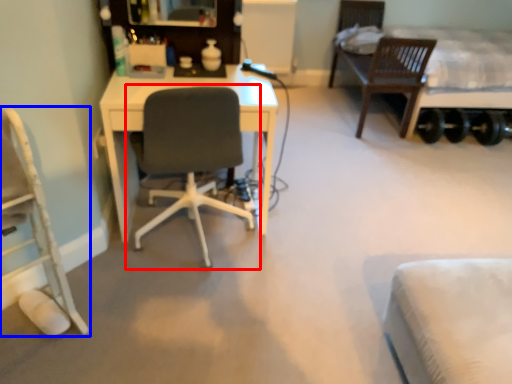
Question: Which of the following is the farthest to the observer, chair (highlighted by a red box) or chair (highlighted by a blue box)?

Choices:
 (A) chair
 (B) chair

Answer: (A)